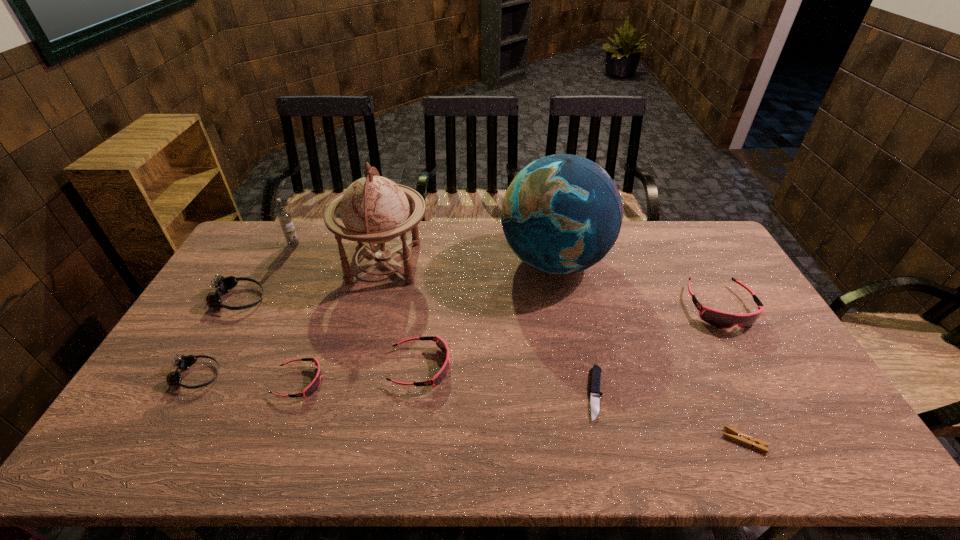
Locate an element on the screen. vacant point located on the front-facing side of the leftmost pink goggles is located at coordinates (346, 382).

Locate an element on the screen. The height and width of the screenshot is (540, 960). blank space located 0.360m on the left of the steak knife is located at coordinates (448, 394).

Where is `vacant area situated 0.350m on the back of the clothespin`? The width and height of the screenshot is (960, 540). vacant area situated 0.350m on the back of the clothespin is located at coordinates (688, 322).

Where is `vodka present at the far edge`? This screenshot has height=540, width=960. vodka present at the far edge is located at coordinates (284, 217).

Identify the location of object present at the near edge. (743, 438).

You are a GUI agent. You are given a task and a screenshot of the screen. Output one action in this format:
    pyautogui.click(x=<x>, y=<y>)
    Task: Click on the object that is positioned at the right edge
    The width and height of the screenshot is (960, 540).
    Given the screenshot: What is the action you would take?
    pyautogui.click(x=724, y=320)

In the image, there is a desktop. Where is `vacant space at the far edge`? This screenshot has height=540, width=960. vacant space at the far edge is located at coordinates (447, 236).

Image resolution: width=960 pixels, height=540 pixels. I want to click on vacant space at the near edge, so pyautogui.click(x=219, y=441).

Identify the location of vacant space at the left edge of the desktop. (215, 313).

Find the location of `vacant space at the right edge of the desktop`. vacant space at the right edge of the desktop is located at coordinates (791, 413).